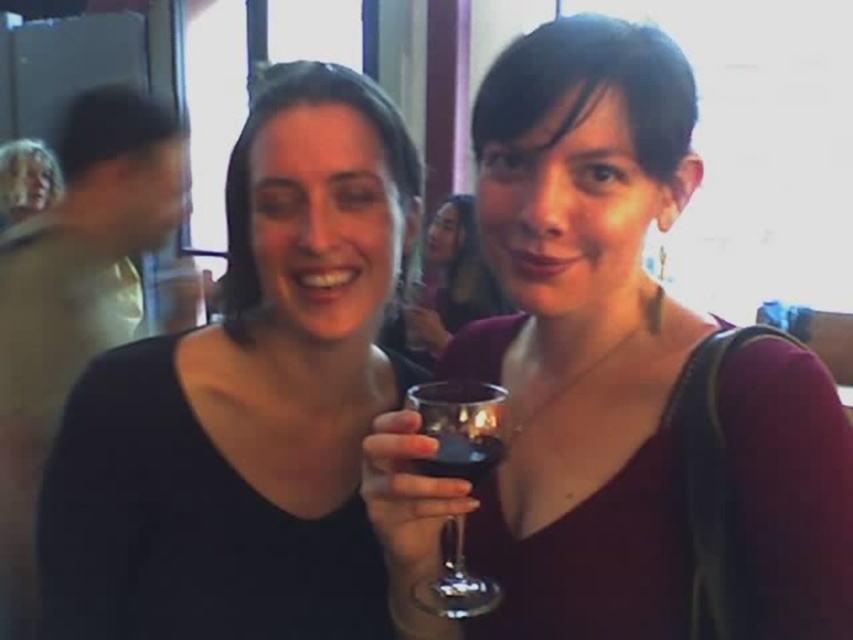
Question: Which point appears closest to the camera in this image?

Choices:
 (A) (364, 177)
 (B) (16, 168)
 (C) (451, 518)
 (D) (412, 305)

Answer: (C)

Question: Which object is positioned closest to the transparent glass at center?

Choices:
 (A) light beige shirt at left
 (B) black matte wine glass at center

Answer: (B)

Question: Considering the real-world distances, which object is farthest from the light beige shirt at left?

Choices:
 (A) matte glass wine at center
 (B) black matte wine glass at center
 (C) matte black dress at center

Answer: (A)

Question: Does transparent glass wine glass at center appear on the left side of blonde hair at upper left?

Choices:
 (A) no
 (B) yes

Answer: (A)

Question: Can you confirm if light beige shirt at left is smaller than matte black dress at center?

Choices:
 (A) no
 (B) yes

Answer: (A)

Question: In this image, where is matte glass wine at center located relative to black matte wine glass at center?

Choices:
 (A) above
 (B) below

Answer: (A)